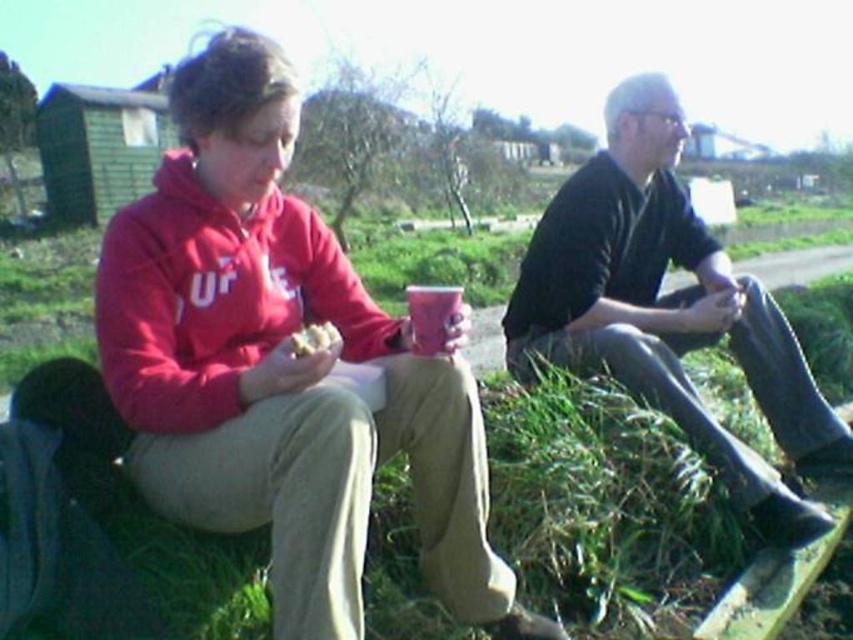
You are a person who wants to drink water from the matte plastic cup at center without getting crumbs from the crumbly bread at center into the cup. What should you do first?

The matte plastic cup at center is much taller than the crumbly bread at center, so you can carefully pick up the matte plastic cup at center first to avoid knocking over the crumbly bread at center.

You are planning to place a new bench in the scene so that it is between the rubber boots at right and the matte plastic cup at center. Based on their positions, which object should the bench be closer to?

The bench should be closer to the matte plastic cup at center because the rubber boots at right is to the right of the matte plastic cup at center, meaning the cup is closer to the center and the boots are further to the right.

You are a photographer trying to capture a clear shot of the matte plastic cup at center without the rubber boots at right blocking it. Based on the scene, how should you adjust your position?

The matte plastic cup at center is behind the rubber boots at right, so you should move your position to the side so that the rubber boots at right are no longer in front of the matte plastic cup at center.